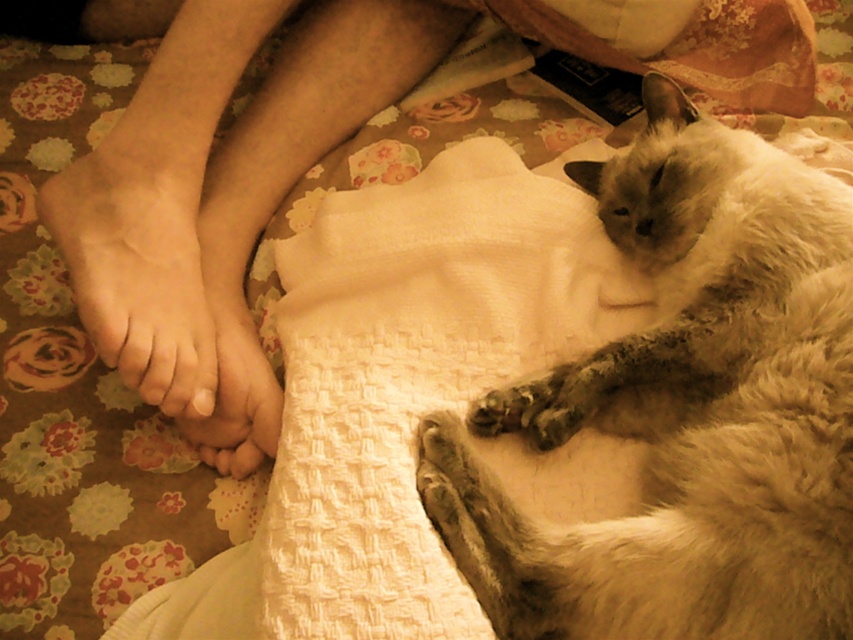
Question: Which object is positioned closest to the silky white cat at upper right?

Choices:
 (A) smooth skin foot at center
 (B) smooth skin foot at lower left

Answer: (A)

Question: Which point is farther to the camera?

Choices:
 (A) (231, 378)
 (B) (39, 195)
 (C) (566, 564)

Answer: (B)

Question: Does smooth skin foot at lower left appear on the left side of smooth skin foot at center?

Choices:
 (A) no
 (B) yes

Answer: (B)

Question: Is smooth skin foot at lower left behind smooth skin foot at center?

Choices:
 (A) yes
 (B) no

Answer: (B)

Question: Among these points, which one is farthest from the camera?

Choices:
 (A) (244, 320)
 (B) (136, 368)
 (C) (550, 372)

Answer: (A)

Question: Is smooth skin foot at lower left smaller than smooth skin foot at center?

Choices:
 (A) no
 (B) yes

Answer: (A)